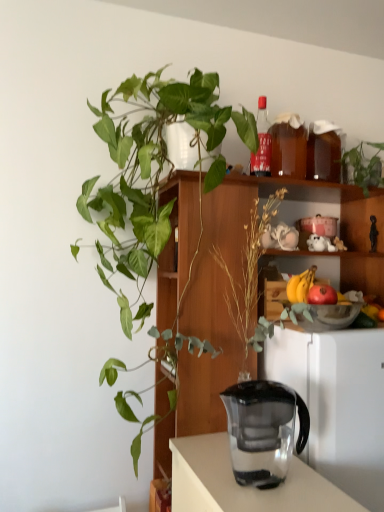
You are a GUI agent. You are given a task and a screenshot of the screen. Output one action in this format:
    pyautogui.click(x=<x>, y=<y>)
    Task: Click on the space that is in front of red matte apple at upper right
    Image resolution: width=384 pixels, height=512 pixels.
    Given the screenshot: What is the action you would take?
    pyautogui.click(x=332, y=333)